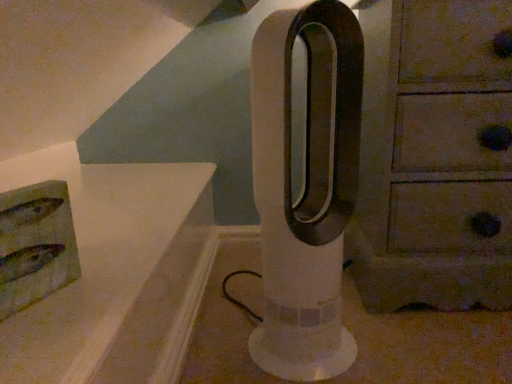
Question: Considering the positions of point (294, 362) and point (373, 125), is point (294, 362) closer or farther from the camera than point (373, 125)?

Choices:
 (A) closer
 (B) farther

Answer: (A)

Question: Relative to wooden chest of drawers at right, is white plastic fan at center in front or behind?

Choices:
 (A) front
 (B) behind

Answer: (A)

Question: From the image's perspective, relative to wooden chest of drawers at right, is white plastic fan at center above or below?

Choices:
 (A) below
 (B) above

Answer: (A)

Question: Looking at the image, does wooden chest of drawers at right seem bigger or smaller compared to white plastic fan at center?

Choices:
 (A) big
 (B) small

Answer: (A)

Question: From a real-world perspective, is wooden chest of drawers at right positioned above or below white plastic fan at center?

Choices:
 (A) below
 (B) above

Answer: (B)

Question: From the image's perspective, is wooden chest of drawers at right above or below white plastic fan at center?

Choices:
 (A) below
 (B) above

Answer: (B)

Question: Is wooden chest of drawers at right situated inside white plastic fan at center or outside?

Choices:
 (A) outside
 (B) inside

Answer: (A)